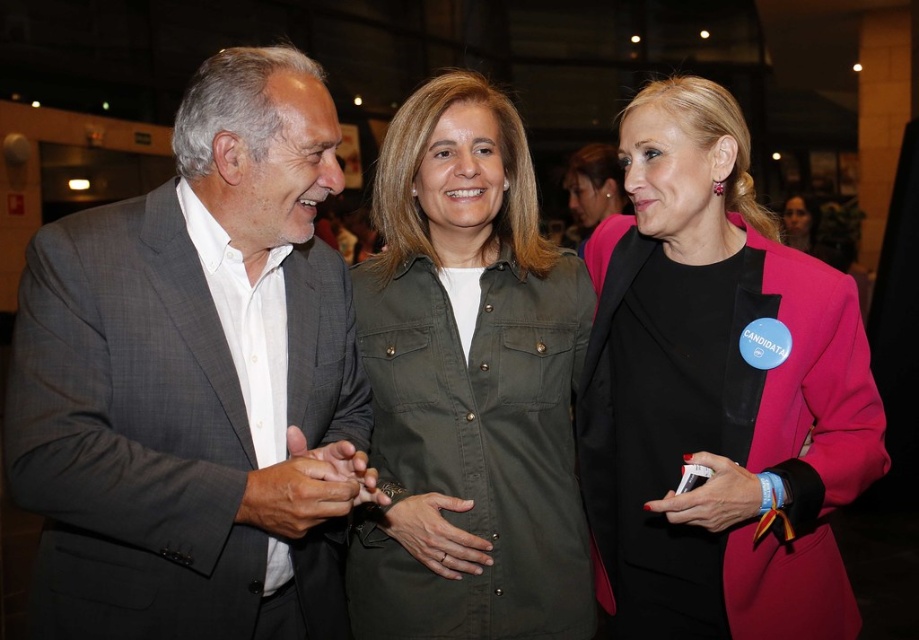
Consider the image. You are standing at the center of the room and want to move towards the point labeled as point [681,100]. Is this point closer to you than the other point labeled as point [528,589]?

Yes, the point labeled as point [681,100] is closer to you than the point labeled as point [528,589] because it is positioned in front of it.

Looking at this image, you are a photographer at the event and need to capture a photo of the pink matte blazer at center and the green matte shirt at center. The camera you are using has a minimum focus distance of 12 inches. Can you take a clear photo of both items without moving the camera or the subjects?

Yes, the distance between the pink matte blazer at center and the green matte shirt at center is 13.37 inches, which is greater than the camera minimum focus distance of 12 inches. Therefore, the camera can focus on both items clearly.